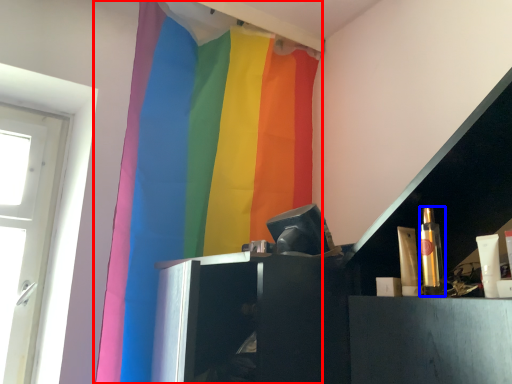
Question: Which of the following is the closest to the observer, curtain (highlighted by a red box) or toiletry (highlighted by a blue box)?

Choices:
 (A) curtain
 (B) toiletry

Answer: (B)